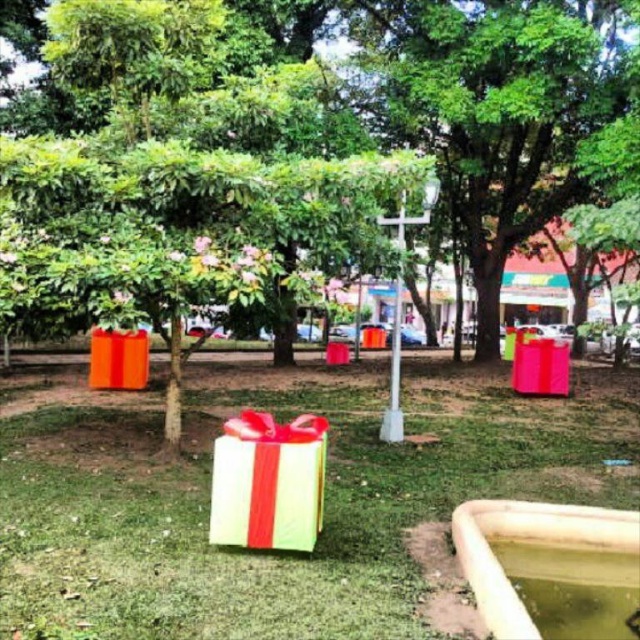
Question: In this image, where is green grass at center located relative to matte orange gift at center?

Choices:
 (A) above
 (B) below

Answer: (B)

Question: Which point is farther to the camera?

Choices:
 (A) orange matte gift box at center
 (B) matte orange gift at center

Answer: (A)

Question: Does orange matte gift box at center have a smaller size compared to pink glossy gift box at center?

Choices:
 (A) yes
 (B) no

Answer: (A)

Question: Is matte orange gift at center further to the viewer compared to green matte gift box at center?

Choices:
 (A) yes
 (B) no

Answer: (A)

Question: Based on their relative distances, which object is nearer to the green grass at center?

Choices:
 (A) matte orange gift at center
 (B) orange matte gift box at center

Answer: (B)

Question: Which point appears closest to the camera in this image?

Choices:
 (A) (470, 49)
 (B) (227, 474)
 (C) (72, 570)

Answer: (C)